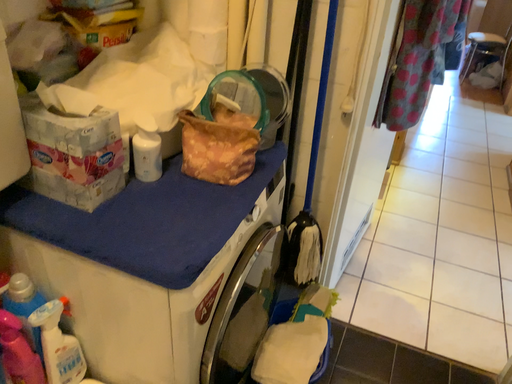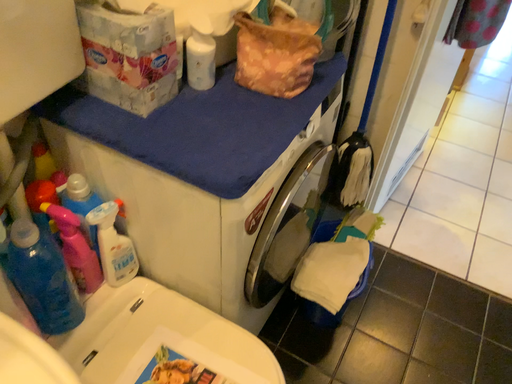
Question: Which way did the camera rotate in the video?

Choices:
 (A) rotated downward
 (B) rotated upward

Answer: (A)